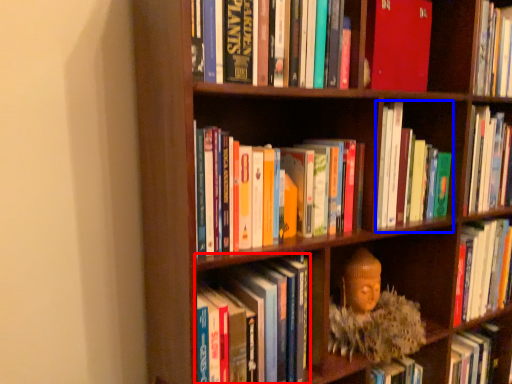
Question: Which point is further to the camera, book (highlighted by a red box) or book (highlighted by a blue box)?

Choices:
 (A) book
 (B) book

Answer: (B)